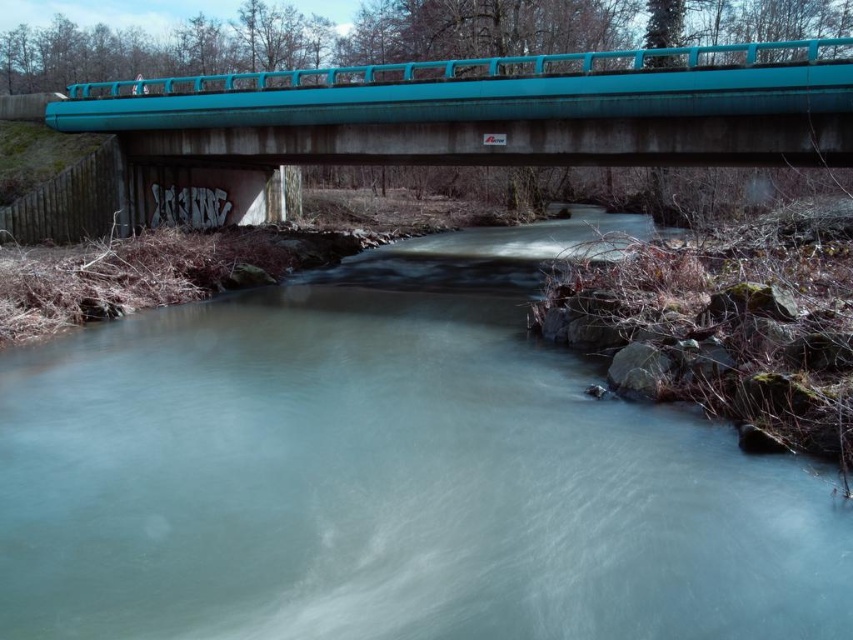
You are standing at the origin point of the image. Which direction should you move to reach the clear water at center?

The clear water at center is located at point 0.741 on the x axis and 0.460 on the y axis. Since the origin is at the bottom left corner of the image, you should move to the right and slightly upward to reach it.

You are a boat operator trying to navigate a narrow boat through the river under the bridge. The boat is as wide as the clear water at center. Will the boat fit under the teal concrete bridge at upper center?

The clear water at center is narrower than the teal concrete bridge at upper center, so the boat, which is as wide as the clear water at center, will fit under the teal concrete bridge at upper center.

You are standing at a point on the bridge and want to know how far you are from the camera. The point you are standing at is labeled as point (x=344, y=531). Can you determine the distance?

The distance between point (x=344, y=531) and the camera is 5.56 meters.